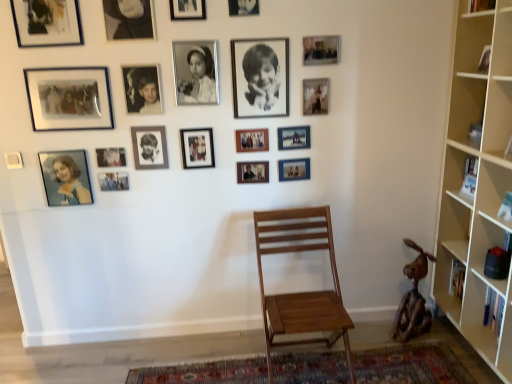
Question: From a real-world perspective, is matte black photo frame at upper left, which is the nineteenth picture frame in right-to-left order, on top of rustic wood sculpture at lower right?

Choices:
 (A) no
 (B) yes

Answer: (B)

Question: Is matte black photo frame at upper left, which is the nineteenth picture frame in right-to-left order, directly adjacent to rustic wood sculpture at lower right?

Choices:
 (A) no
 (B) yes

Answer: (A)

Question: From the image's perspective, is matte black photo frame at upper left, which is the nineteenth picture frame in right-to-left order, located beneath rustic wood sculpture at lower right?

Choices:
 (A) no
 (B) yes

Answer: (A)

Question: Considering the relative positions of matte black photo frame at upper left, arranged as the 1th picture frame when viewed from the left, and rustic wood sculpture at lower right in the image provided, is matte black photo frame at upper left, arranged as the 1th picture frame when viewed from the left, to the right of rustic wood sculpture at lower right from the viewer's perspective?

Choices:
 (A) no
 (B) yes

Answer: (A)

Question: Does matte black photo frame at upper left, which is the nineteenth picture frame in right-to-left order, have a lesser width compared to rustic wood sculpture at lower right?

Choices:
 (A) yes
 (B) no

Answer: (A)

Question: Considering the relative sizes of matte black photo frame at upper left, arranged as the 1th picture frame when viewed from the left, and rustic wood sculpture at lower right in the image provided, is matte black photo frame at upper left, arranged as the 1th picture frame when viewed from the left, wider than rustic wood sculpture at lower right?

Choices:
 (A) no
 (B) yes

Answer: (A)

Question: Is matte wooden picture frame at center, arranged as the seventeenth picture frame when viewed from the left, surrounding wooden chair at center?

Choices:
 (A) no
 (B) yes

Answer: (A)

Question: Does matte wooden picture frame at center, which is the third picture frame in right-to-left order, have a greater width compared to wooden chair at center?

Choices:
 (A) yes
 (B) no

Answer: (B)

Question: Considering the relative sizes of matte wooden picture frame at center, arranged as the seventeenth picture frame when viewed from the left, and wooden chair at center in the image provided, is matte wooden picture frame at center, arranged as the seventeenth picture frame when viewed from the left, bigger than wooden chair at center?

Choices:
 (A) no
 (B) yes

Answer: (A)

Question: Can you confirm if matte wooden picture frame at center, arranged as the seventeenth picture frame when viewed from the left, is taller than wooden chair at center?

Choices:
 (A) no
 (B) yes

Answer: (A)

Question: Is matte wooden picture frame at center, which is the third picture frame in right-to-left order, aimed at wooden chair at center?

Choices:
 (A) yes
 (B) no

Answer: (B)

Question: Is matte wooden picture frame at center, which is the third picture frame in right-to-left order, smaller than wooden chair at center?

Choices:
 (A) yes
 (B) no

Answer: (A)

Question: Is wooden chair at center a part of black matte photo frame at center, placed as the fifteenth picture frame when sorted from left to right?

Choices:
 (A) yes
 (B) no

Answer: (B)